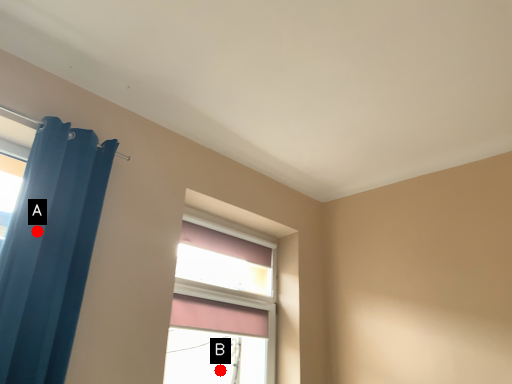
Question: Two points are circled on the image, labeled by A and B beside each circle. Which point is farther to the camera?

Choices:
 (A) A is further
 (B) B is further

Answer: (B)